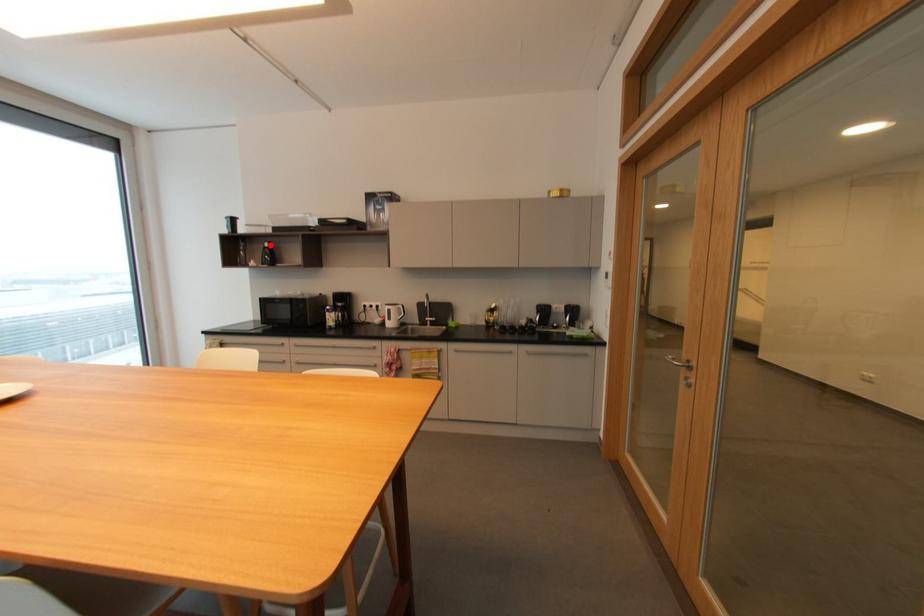
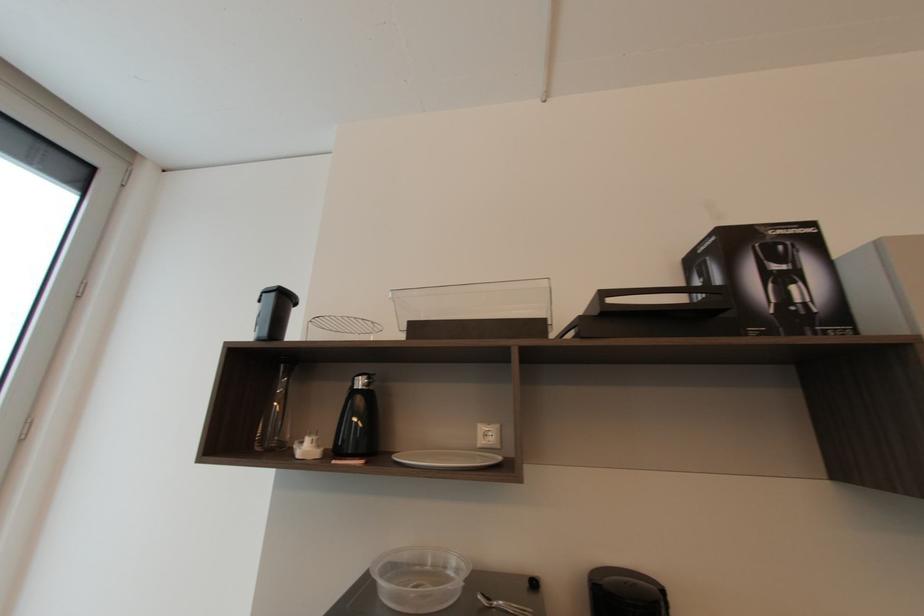
Find the pixel in the second image that matches the highlighted location in the first image.

(362, 384)